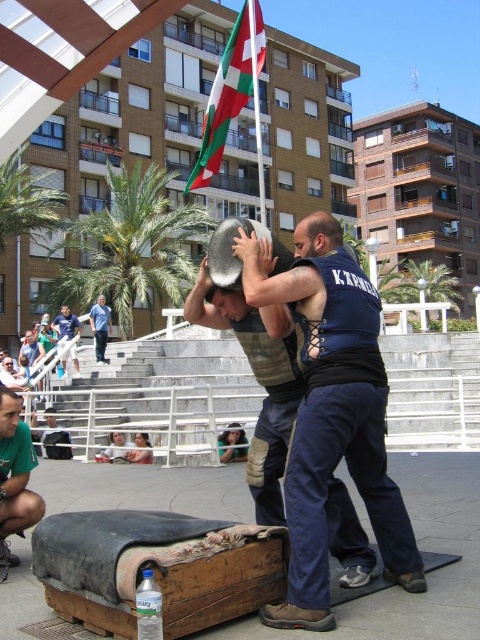
Question: Observing the image, what is the correct spatial positioning of green fabric man at lower left in reference to blue cotton shirt at lower left?

Choices:
 (A) below
 (B) above

Answer: (A)

Question: Which is nearer to the green fabric man at lower left?

Choices:
 (A) green and white fabric flag at upper center
 (B) dark blue uniform at center
 (C) blue denim jeans at lower left

Answer: (B)

Question: Which of the following is the closest to the observer?

Choices:
 (A) (230, 61)
 (B) (6, 477)
 (C) (317, 268)

Answer: (C)

Question: Does green and white fabric flag at upper center appear on the right side of green fabric man at lower left?

Choices:
 (A) yes
 (B) no

Answer: (A)

Question: Observing the image, what is the correct spatial positioning of green fabric man at lower left in reference to blue cotton shirt at lower left?

Choices:
 (A) left
 (B) right

Answer: (B)

Question: Among these points, which one is farthest from the camera?

Choices:
 (A) (264, 42)
 (B) (1, 392)
 (C) (336, 262)
 (D) (79, 332)

Answer: (D)